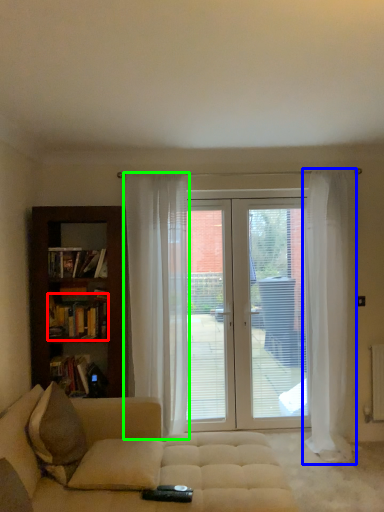
Question: Considering the real-world distances, which object is farthest from book (highlighted by a red box)? curtain (highlighted by a blue box) or curtain (highlighted by a green box)?

Choices:
 (A) curtain
 (B) curtain

Answer: (A)